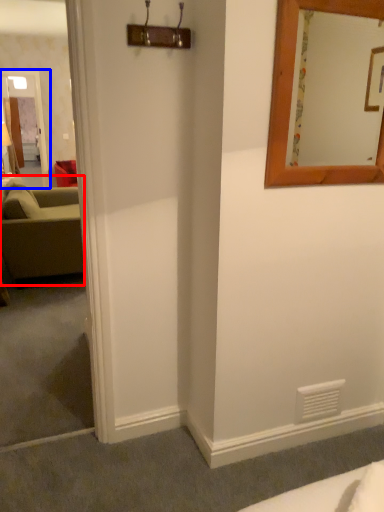
Question: Which of the following is the farthest to the observer, studio couch (highlighted by a red box) or glass door (highlighted by a blue box)?

Choices:
 (A) studio couch
 (B) glass door

Answer: (B)